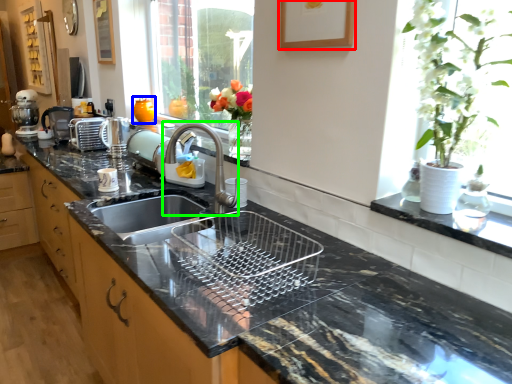
Question: Which object is positioned closest to picture frame (highlighted by a red box)? Select from vase (highlighted by a blue box) and tap (highlighted by a green box).

Choices:
 (A) vase
 (B) tap

Answer: (B)